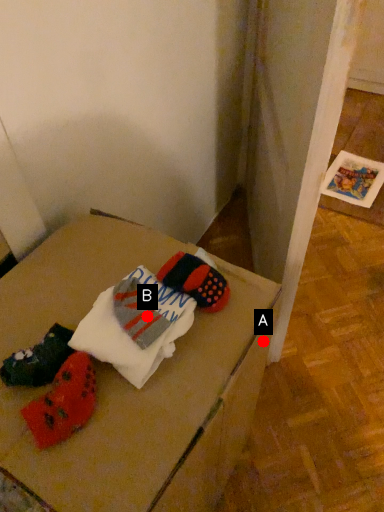
Question: Two points are circled on the image, labeled by A and B beside each circle. Which point is closer to the camera taking this photo?

Choices:
 (A) A is closer
 (B) B is closer

Answer: (B)